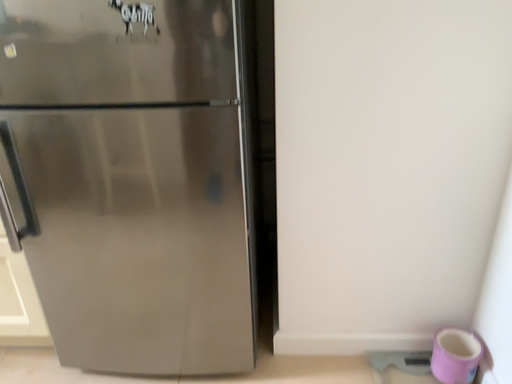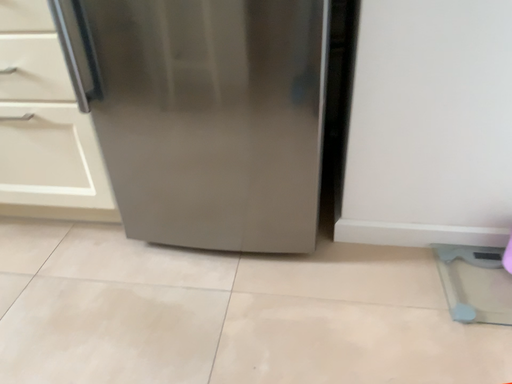
Question: How did the camera likely rotate when shooting the video?

Choices:
 (A) rotated downward
 (B) rotated upward

Answer: (A)